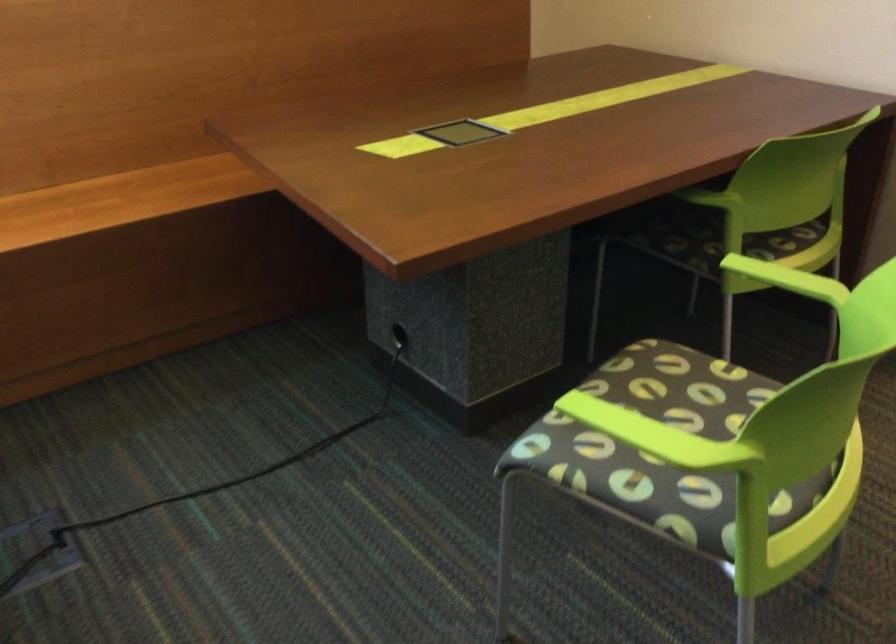
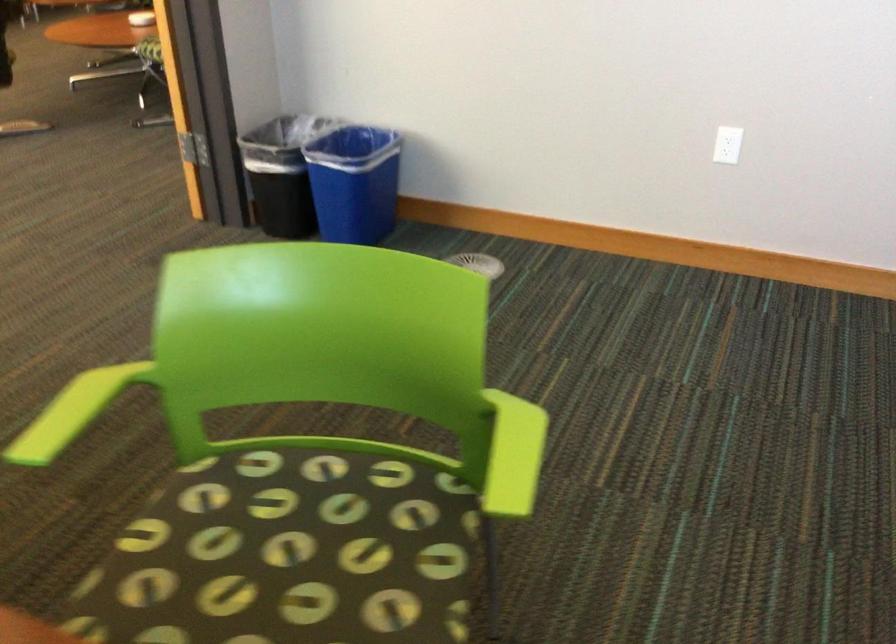
Find the pixel in the second image that matches the point at 738,261 in the first image.

(55, 429)